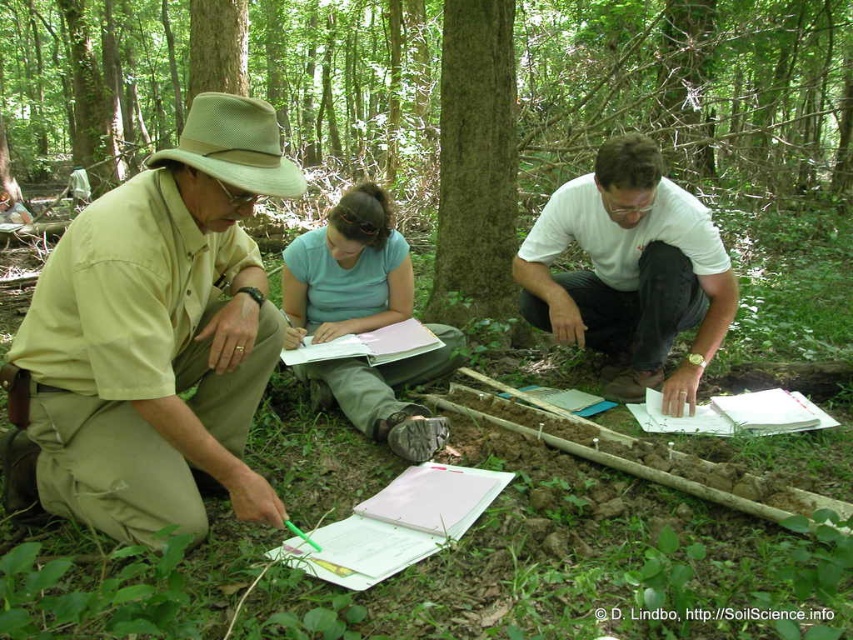
Is point (498, 236) farther from viewer compared to point (323, 563)?

Yes.

Is point (466, 300) behind point (403, 516)?

That is True.

This screenshot has height=640, width=853. Identify the location of green rough bark tree at center. (474, 164).

Between light blue cotton shirt at center and green rough bark tree at center, which one is positioned lower?

Positioned lower is light blue cotton shirt at center.

Is light blue cotton shirt at center to the right of green rough bark tree at center from the viewer's perspective?

No, light blue cotton shirt at center is not to the right of green rough bark tree at center.

Locate an element on the screen. light blue cotton shirt at center is located at coordinates (347, 272).

Between point (230, 321) and point (650, 145), which one is positioned in front?

Point (230, 321) is in front.

Between khaki cotton shirt at center and white matte shirt at center, which one has more height?

With more height is khaki cotton shirt at center.

Which is in front, point (271, 163) or point (680, 276)?

Positioned in front is point (271, 163).

Locate an element on the screen. The image size is (853, 640). khaki cotton shirt at center is located at coordinates (157, 336).